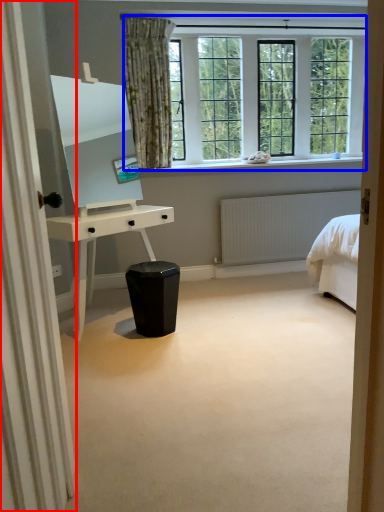
Question: Which object is closer to the camera taking this photo, curtain (highlighted by a red box) or window (highlighted by a blue box)?

Choices:
 (A) curtain
 (B) window

Answer: (A)